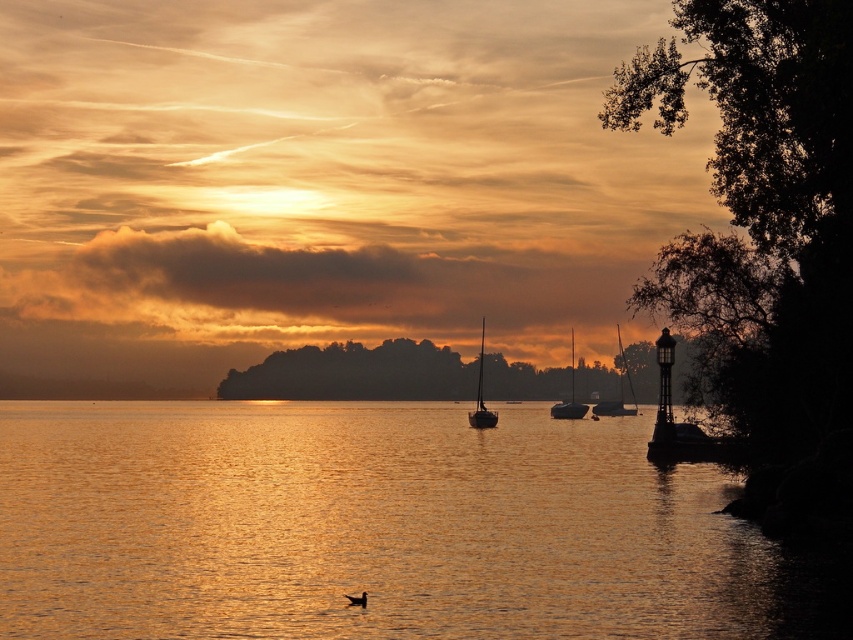
You are standing on the shore looking at the golden reflective water at center and the satin black sailboat at center. Which object appears nearer to you?

The golden reflective water at center appears nearer to you because it is closer to the viewer than the satin black sailboat at center.